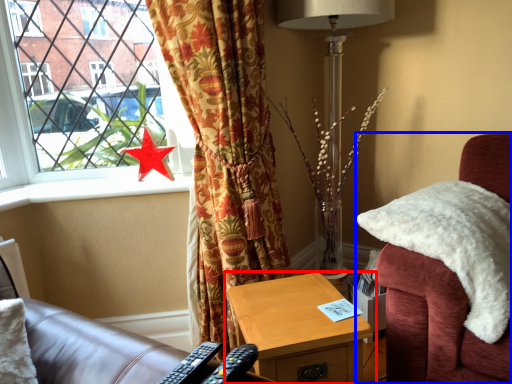
Question: Which object appears farthest to the camera in this image, nightstand (highlighted by a red box) or chair (highlighted by a blue box)?

Choices:
 (A) nightstand
 (B) chair

Answer: (A)